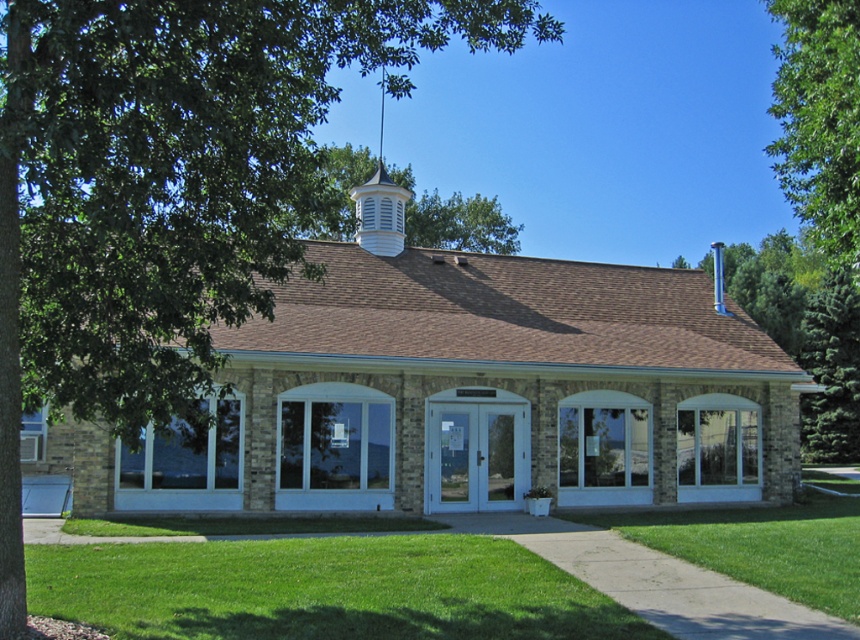
Is point (41, 76) more distant than point (803, 154)?

No.

Can you confirm if green leafy tree at upper left is wider than green leafy tree at upper right?

Incorrect, green leafy tree at upper left's width does not surpass green leafy tree at upper right's.

Identify the location of green leafy tree at upper left. Image resolution: width=860 pixels, height=640 pixels. (169, 189).

Identify the location of green leafy tree at upper left. (169, 189).

Is the position of brick building at center less distant than that of green leafy tree at upper left?

No.

Is brick building at center bigger than green leafy tree at upper left?

Actually, brick building at center might be smaller than green leafy tree at upper left.

Is point (358, 346) farther from camera compared to point (191, 269)?

Yes, point (358, 346) is behind point (191, 269).

At what (x,y) coordinates should I click in order to perform the action: click on brick building at center. Please return your answer as a coordinate pair (x, y). Looking at the image, I should click on (464, 390).

Does green leafy tree at upper left appear on the right side of green grass at lower center?

Indeed, green leafy tree at upper left is positioned on the right side of green grass at lower center.

Measure the distance between point (43, 20) and camera.

The distance of point (43, 20) from camera is 6.78 meters.

Locate an element on the screen. Image resolution: width=860 pixels, height=640 pixels. green leafy tree at upper left is located at coordinates (169, 189).